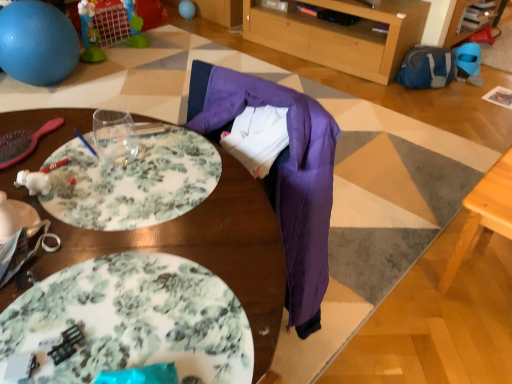
Locate an element on the screen. vacant space positioned to the left of light wood table at lower right, the 1th table viewed from the right is located at coordinates (392, 269).